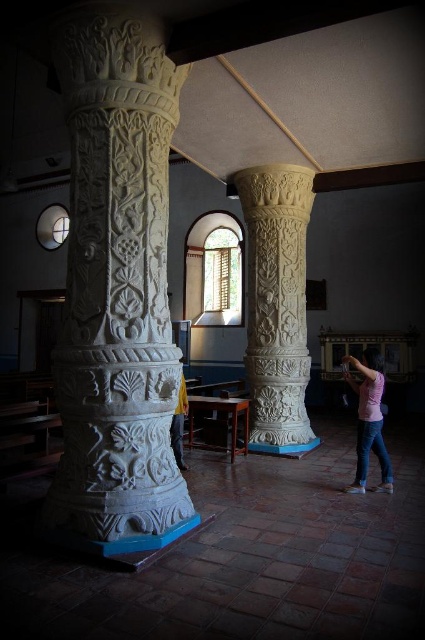
You are an interior designer observing the space. You need to hang a decorative item on the white stone column at left. However, the hook for the item must be placed below the yellow fabric at center. Is this possible?

The white stone column at left is above the yellow fabric at center, so the hook cannot be placed below the yellow fabric at center on the column since the column is positioned higher than the fabric.

You are an interior designer assessing the space between the white stone column at left and the yellow fabric at center. Which object takes up more space in the scene?

The white stone column at left is bigger than the yellow fabric at center, so it takes up more space in the scene.

You are an interior designer assessing the space between the white stone column at left and the pink cotton shirt at lower right. If you want to place a decorative vase between them, which object should you position the vase closer to to ensure it fits within the space?

The white stone column at left is wider than the pink cotton shirt at lower right, so positioning the vase closer to the pink cotton shirt at lower right would allow it to fit within the space more effectively.